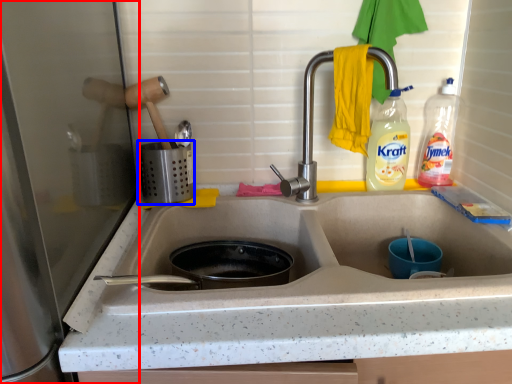
Question: Which point is closer to the camera, appliance (highlighted by a red box) or appliance (highlighted by a blue box)?

Choices:
 (A) appliance
 (B) appliance

Answer: (A)